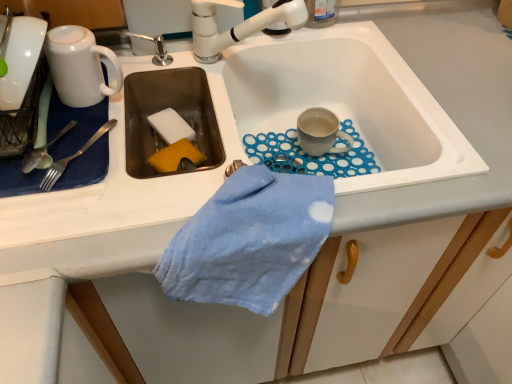
This screenshot has height=384, width=512. I want to click on free space to the left of white ceramic tap at upper center, so click(175, 64).